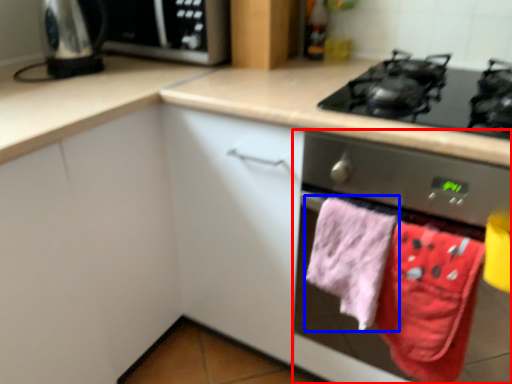
Question: Which point is closer to the camera, home appliance (highlighted by a red box) or beach towel (highlighted by a blue box)?

Choices:
 (A) home appliance
 (B) beach towel

Answer: (A)